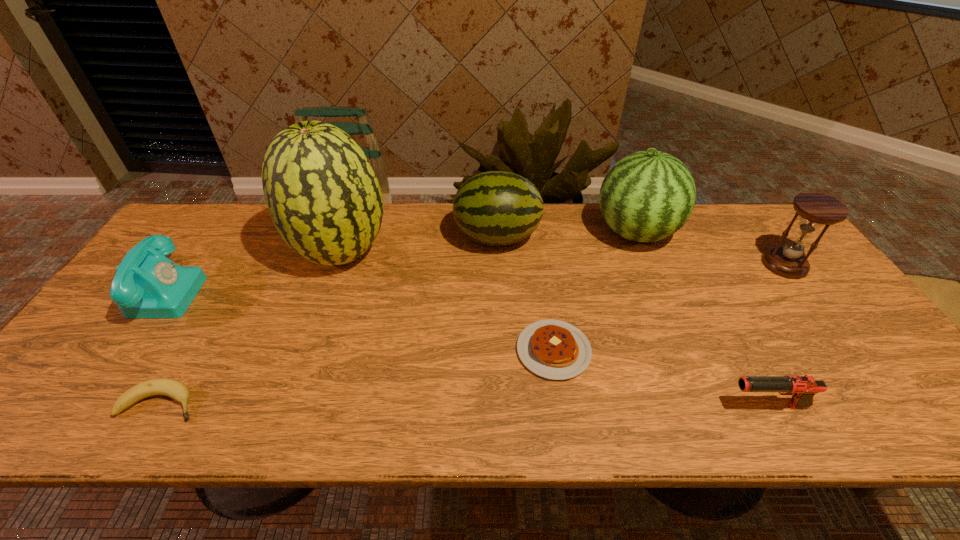
This screenshot has width=960, height=540. I want to click on the tallest object, so click(x=324, y=198).

I want to click on the leftmost watermelon, so click(324, 198).

This screenshot has height=540, width=960. Find the location of `the second shortest watermelon`. the second shortest watermelon is located at coordinates (647, 196).

Locate an element on the screen. This screenshot has height=540, width=960. the rightmost watermelon is located at coordinates (647, 196).

Identify the location of the shortest watermelon. The height and width of the screenshot is (540, 960). (496, 208).

At what (x,y) coordinates should I click in order to perform the action: click on the rightmost object. Please return your answer as a coordinate pair (x, y). Looking at the image, I should click on (816, 209).

This screenshot has width=960, height=540. Find the location of `the fifth tallest object`. the fifth tallest object is located at coordinates (147, 284).

This screenshot has height=540, width=960. I want to click on gun, so click(x=802, y=388).

The height and width of the screenshot is (540, 960). I want to click on pancake, so click(x=553, y=349).

The width and height of the screenshot is (960, 540). Find the location of `banana`. banana is located at coordinates (176, 390).